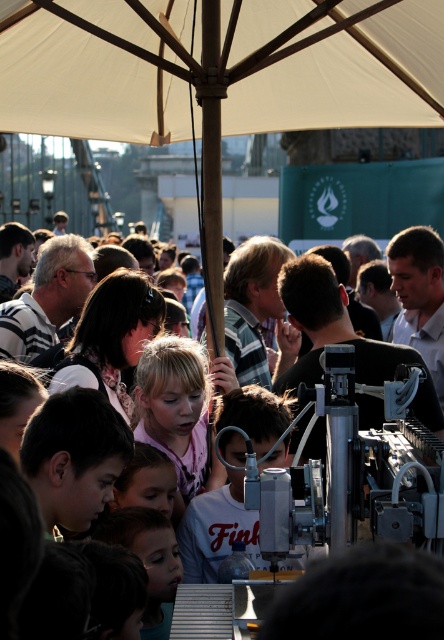
Does white fabric canopy at upper center have a greater width compared to blonde hair at center?

Indeed, white fabric canopy at upper center has a greater width compared to blonde hair at center.

Is point (106, 42) more distant than point (163, 440)?

Yes.

Which is behind, point (14, 54) or point (137, 372)?

Point (14, 54)

Locate an element on the screen. The height and width of the screenshot is (640, 444). white fabric canopy at upper center is located at coordinates (218, 65).

Measure the distance between white matte shirt at center and camera.

white matte shirt at center and camera are 15.70 meters apart from each other.

Does white matte shirt at center appear under blonde hair at center?

Correct, white matte shirt at center is located below blonde hair at center.

Is point (229, 480) less distant than point (199, 468)?

Yes, point (229, 480) is closer to viewer.

The height and width of the screenshot is (640, 444). What are the coordinates of `white matte shirt at center` in the screenshot? It's located at (217, 531).

Who is positioned more to the right, white fabric canopy at upper center or white matte shirt at center?

white matte shirt at center

Does point (86, 88) come closer to viewer compared to point (209, 524)?

That is False.

I want to click on white fabric canopy at upper center, so click(x=218, y=65).